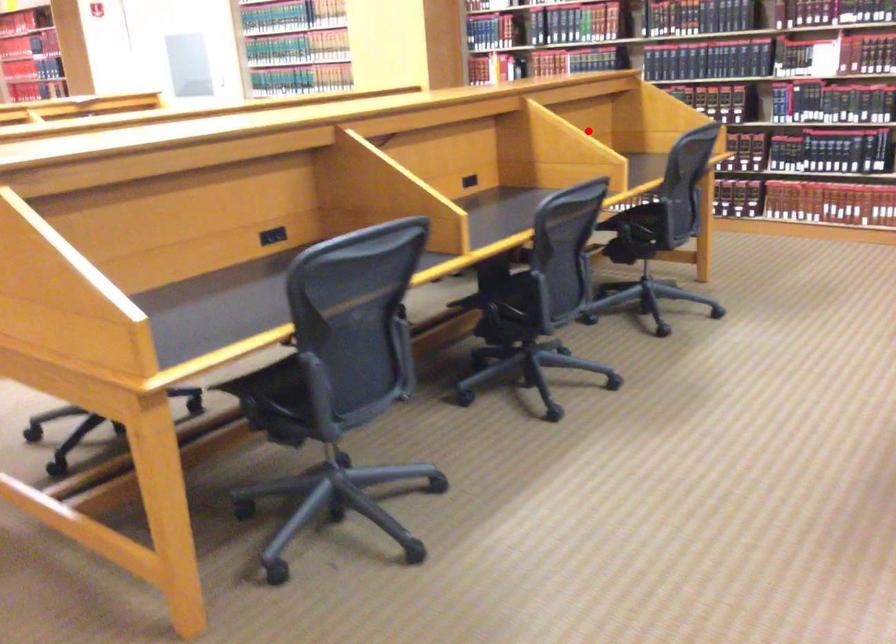
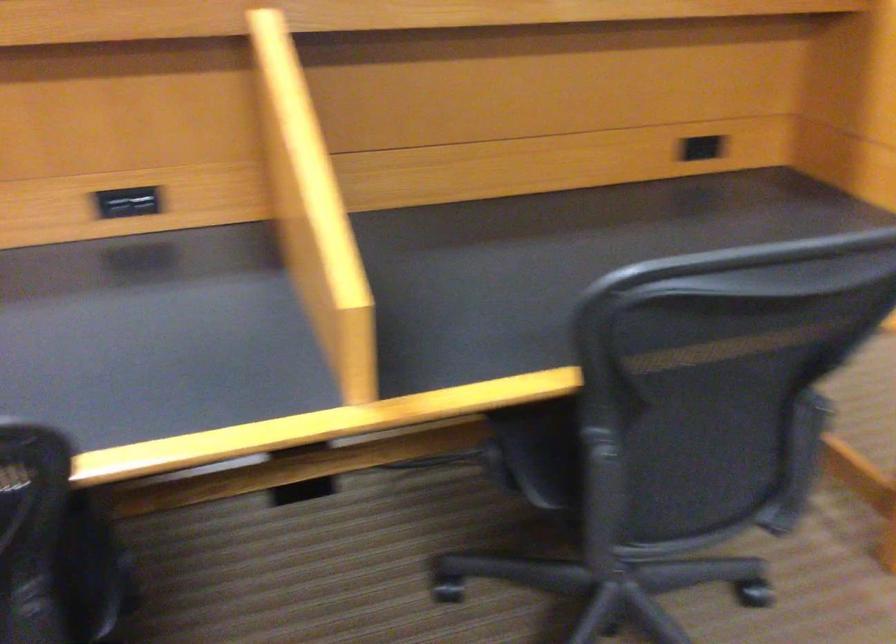
Question: I am providing you with two images of the same scene from different viewpoints. Image1 has a red point marked. In image2, the corresponding 3D location appears at what relative position? Reply with the corresponding letter.

Choices:
 (A) Closer
 (B) Farther

Answer: (A)